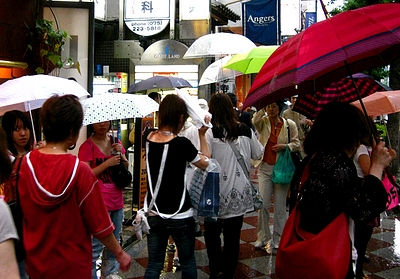
I want to click on red tiles, so click(249, 251), click(247, 231), click(252, 219), click(241, 266), click(201, 247), click(145, 261), click(380, 246), click(378, 267).